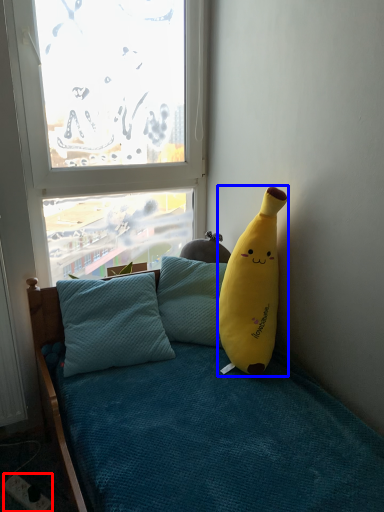
Question: Which of the following is the farthest to the observer, power outlet (highlighted by a red box) or banana (highlighted by a blue box)?

Choices:
 (A) power outlet
 (B) banana

Answer: (A)